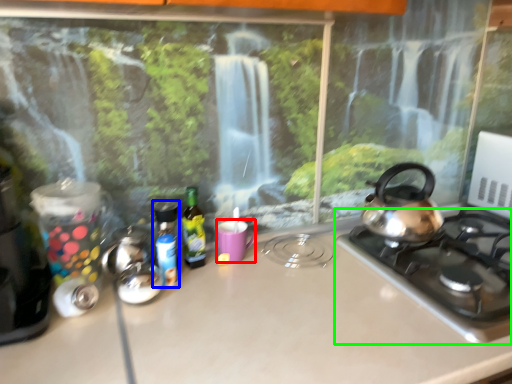
Question: Considering the real-world distances, which object is closest to mug (highlighted by a red box)? bottle (highlighted by a blue box) or gas stove (highlighted by a green box).

Choices:
 (A) bottle
 (B) gas stove

Answer: (A)